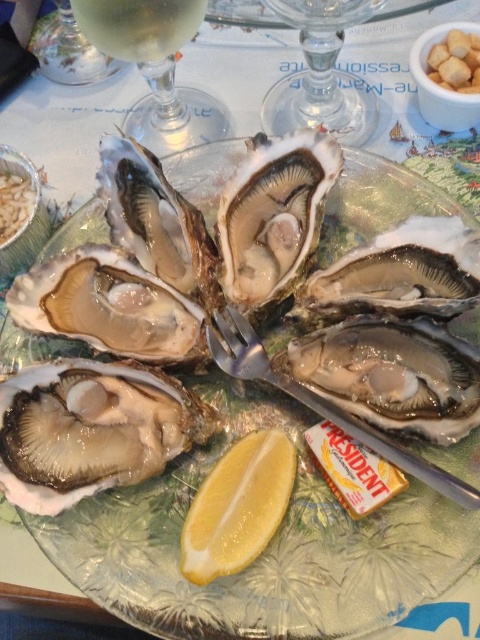
Consider the image. You are a server arranging the oysters on the plate. You need to ensure that the yellow matte lemon at center is wider than the shiny silver oyster at center. Can you confirm if the current arrangement meets this requirement?

The shiny silver oyster at center might be wider than yellow matte lemon at center, so the current arrangement does not meet the requirement since the lemon is narrower.

In the image of the oyster plate, where is the shiny silver oyster at center in relation to the transparent glass wine glass at upper left?

The shiny silver oyster at center is to the right of the transparent glass wine glass at upper left.

You are a food stylist arranging a photo shoot. You need to place a new garnish between the shiny silver oyster at center and the yellow matte lemon at center. Where should you place it so that it is closer to the lemon?

The garnish should be placed between the shiny silver oyster at center and the yellow matte lemon at center, closer to the lemon. Since the shiny silver oyster at center is to the right of the yellow matte lemon at center, placing the garnish near the lemon would mean positioning it to the left side between them.